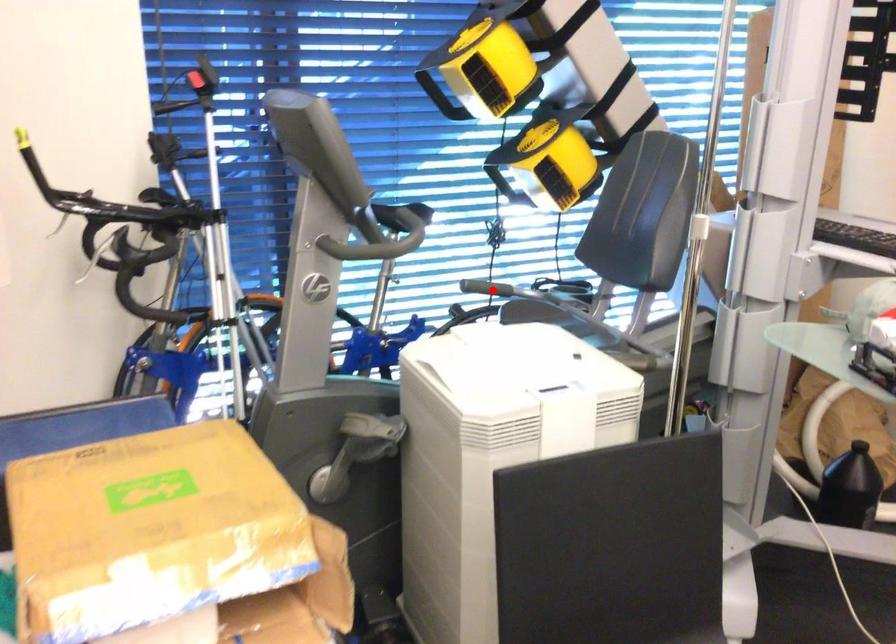
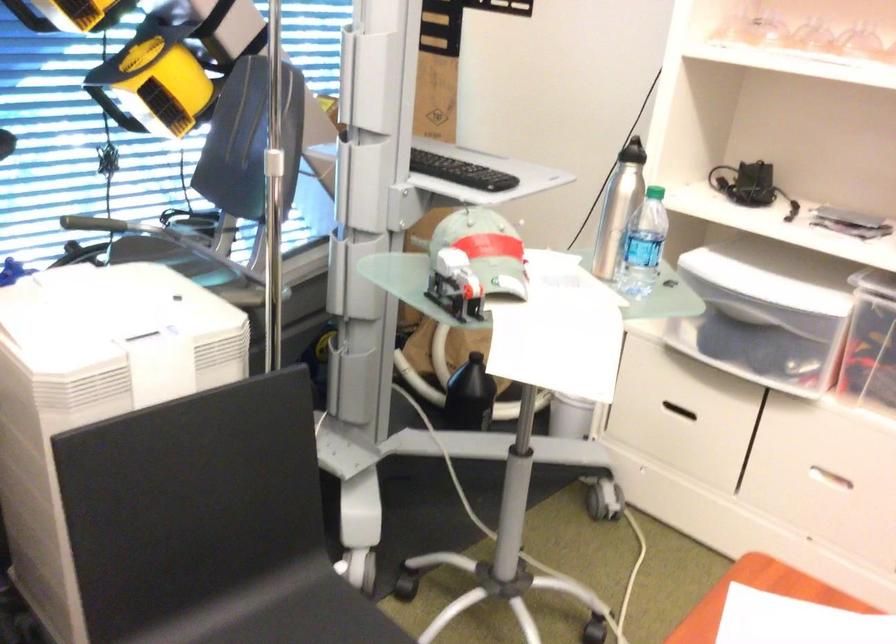
In the second image, find the point that corresponds to the highlighted location in the first image.

(97, 223)